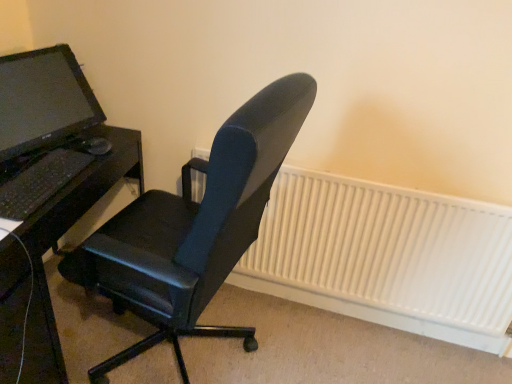
Question: From the image's perspective, is black matte keyboard at left on top of white matte radiator at center?

Choices:
 (A) no
 (B) yes

Answer: (B)

Question: From a real-world perspective, is black matte keyboard at left over white matte radiator at center?

Choices:
 (A) yes
 (B) no

Answer: (A)

Question: From the image's perspective, is black matte keyboard at left below white matte radiator at center?

Choices:
 (A) no
 (B) yes

Answer: (A)

Question: Can you confirm if black matte keyboard at left is wider than white matte radiator at center?

Choices:
 (A) yes
 (B) no

Answer: (A)

Question: Is black matte keyboard at left surrounding white matte radiator at center?

Choices:
 (A) yes
 (B) no

Answer: (B)

Question: Looking at the image, does black leather office chair at center seem bigger or smaller compared to matte black monitor at left?

Choices:
 (A) big
 (B) small

Answer: (A)

Question: From the image's perspective, relative to matte black monitor at left, is black leather office chair at center above or below?

Choices:
 (A) below
 (B) above

Answer: (A)

Question: In the image, is black leather office chair at center positioned in front of or behind matte black monitor at left?

Choices:
 (A) front
 (B) behind

Answer: (A)

Question: Visually, is black leather office chair at center positioned to the left or to the right of matte black monitor at left?

Choices:
 (A) left
 (B) right

Answer: (B)

Question: From the image's perspective, is black matte desk at left above or below matte black monitor at left?

Choices:
 (A) below
 (B) above

Answer: (A)

Question: From a real-world perspective, is black matte desk at left positioned above or below matte black monitor at left?

Choices:
 (A) above
 (B) below

Answer: (B)

Question: From their relative heights in the image, would you say black matte desk at left is taller or shorter than matte black monitor at left?

Choices:
 (A) short
 (B) tall

Answer: (B)

Question: Considering the positions of black matte desk at left and matte black monitor at left in the image, is black matte desk at left bigger or smaller than matte black monitor at left?

Choices:
 (A) big
 (B) small

Answer: (A)

Question: Is white matte radiator at center in front of or behind black matte desk at left in the image?

Choices:
 (A) front
 (B) behind

Answer: (B)

Question: Looking at the image, does white matte radiator at center seem bigger or smaller compared to black matte desk at left?

Choices:
 (A) big
 (B) small

Answer: (B)